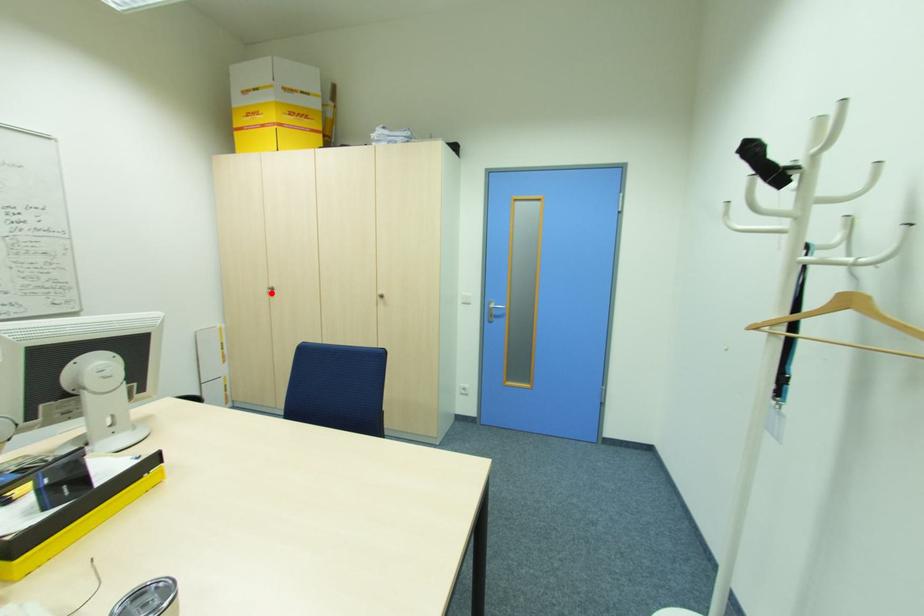
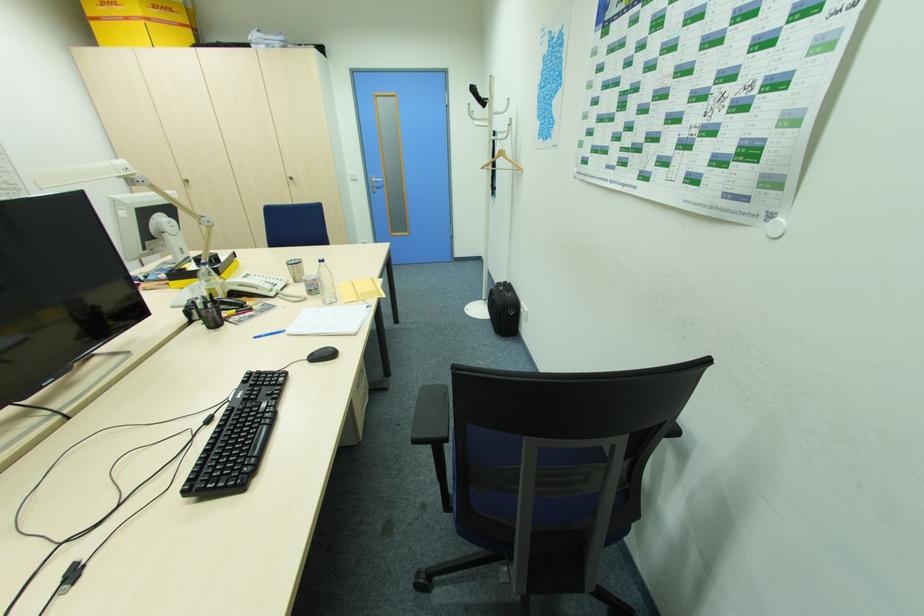
The point at the highlighted location is marked in the first image. Where is the corresponding point in the second image?

(188, 185)